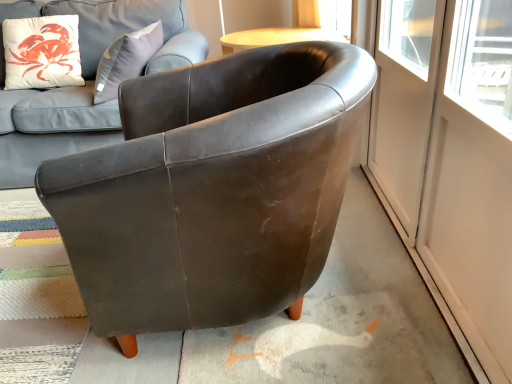
What is the approximate width of matte white cushion at upper left?

matte white cushion at upper left is 26.46 centimeters in width.

Where is `brown leather armchair at center`? This screenshot has height=384, width=512. brown leather armchair at center is located at coordinates (213, 189).

The image size is (512, 384). What are the coordinates of `transparent glass screen door at right, which is the 2th screen door from right to left` in the screenshot? It's located at 445,175.

What do you see at coordinates (86, 82) in the screenshot? This screenshot has width=512, height=384. I see `matte brown leather couch at upper left` at bounding box center [86, 82].

Identify the location of matte white cushion at upper left. (42, 52).

Is point (200, 52) closer to viewer compared to point (477, 182)?

No.

Is matte brown leather couch at upper left inside or outside of transparent glass screen door at right, marked as the first screen door in a left-to-right arrangement?

matte brown leather couch at upper left is spatially situated outside transparent glass screen door at right, marked as the first screen door in a left-to-right arrangement.

Which object is thinner, matte brown leather couch at upper left or transparent glass screen door at right, marked as the first screen door in a left-to-right arrangement?

transparent glass screen door at right, marked as the first screen door in a left-to-right arrangement.

Considering the relative sizes of matte brown leather couch at upper left and transparent glass screen door at right, which is the 2th screen door from right to left, in the image provided, is matte brown leather couch at upper left taller than transparent glass screen door at right, which is the 2th screen door from right to left,?

Yes, matte brown leather couch at upper left is taller than transparent glass screen door at right, which is the 2th screen door from right to left.

Locate an element on the screen. chair beneath the matte brown leather couch at upper left (from a real-world perspective) is located at coordinates (213, 189).

Is there a large distance between matte brown leather couch at upper left and brown leather armchair at center?

matte brown leather couch at upper left is far away from brown leather armchair at center.

Based on the photo, could brown leather armchair at center be considered to be inside matte brown leather couch at upper left?

No, brown leather armchair at center is not a part of matte brown leather couch at upper left.

From a real-world perspective, between matte brown leather couch at upper left and brown leather armchair at center, who is vertically lower?

From a 3D spatial view, brown leather armchair at center is below.

Which of these two, transparent glass screen door at right, marked as the first screen door in a left-to-right arrangement, or brown leather armchair at center, is wider?

→ With larger width is brown leather armchair at center.

From the image's perspective, is transparent glass screen door at right, marked as the first screen door in a left-to-right arrangement, under brown leather armchair at center?

No, from the image's perspective, transparent glass screen door at right, marked as the first screen door in a left-to-right arrangement, is not beneath brown leather armchair at center.

Is transparent glass screen door at right, which is the 2th screen door from right to left, shorter than brown leather armchair at center?

Incorrect, the height of transparent glass screen door at right, which is the 2th screen door from right to left, does not fall short of that of brown leather armchair at center.

Would you consider transparent glass screen door at right, marked as the first screen door in a left-to-right arrangement, to be distant from brown leather armchair at center?

No.

From a real-world perspective, is brown leather armchair at center physically below matte brown leather couch at upper left?

Yes, from a real-world perspective, brown leather armchair at center is below matte brown leather couch at upper left.

I want to click on chair located in front of the matte brown leather couch at upper left, so click(x=213, y=189).

From the image's perspective, is brown leather armchair at center above or below matte brown leather couch at upper left?

From the image's perspective, brown leather armchair at center appears below matte brown leather couch at upper left.

Can you see brown leather armchair at center touching matte brown leather couch at upper left?

There is a gap between brown leather armchair at center and matte brown leather couch at upper left.

Is transparent glass screen door at right, which is the second screen door from left to right, far from matte brown leather couch at upper left?

Answer: Yes.

Which is more to the left, transparent glass screen door at right, which is counted as the 1th screen door, starting from the right, or matte brown leather couch at upper left?

From the viewer's perspective, matte brown leather couch at upper left appears more on the left side.

Considering the relative sizes of transparent glass screen door at right, which is the second screen door from left to right, and matte brown leather couch at upper left in the image provided, is transparent glass screen door at right, which is the second screen door from left to right, smaller than matte brown leather couch at upper left?

Yes, transparent glass screen door at right, which is the second screen door from left to right, is smaller than matte brown leather couch at upper left.

Measure the distance between transparent glass screen door at right, which is counted as the 1th screen door, starting from the right, and matte brown leather couch at upper left.

They are 4.24 feet apart.

Considering their positions, is transparent glass screen door at right, which is the second screen door from left to right, located in front of or behind matte white cushion at upper left?

In the image, transparent glass screen door at right, which is the second screen door from left to right, appears in front of matte white cushion at upper left.

Considering the sizes of objects transparent glass screen door at right, which is the second screen door from left to right, and matte white cushion at upper left in the image provided, who is thinner, transparent glass screen door at right, which is the second screen door from left to right, or matte white cushion at upper left?

Thinner between the two is transparent glass screen door at right, which is the second screen door from left to right.

Is transparent glass screen door at right, which is counted as the 1th screen door, starting from the right, looking in the opposite direction of matte white cushion at upper left?

transparent glass screen door at right, which is counted as the 1th screen door, starting from the right, is not turned away from matte white cushion at upper left.

From a real-world perspective, which object stands above the other?

matte white cushion at upper left is physically above.

Can you confirm if transparent glass screen door at right, marked as the first screen door in a left-to-right arrangement, is wider than transparent glass screen door at right, which is the second screen door from left to right?

Indeed, transparent glass screen door at right, marked as the first screen door in a left-to-right arrangement, has a greater width compared to transparent glass screen door at right, which is the second screen door from left to right.

Between transparent glass screen door at right, marked as the first screen door in a left-to-right arrangement, and transparent glass screen door at right, which is the second screen door from left to right, which one has larger size?

transparent glass screen door at right, marked as the first screen door in a left-to-right arrangement.

Locate an element on the screen. screen door below the transparent glass screen door at right, which is counted as the 1th screen door, starting from the right (from the image's perspective) is located at coordinates (445, 175).

Considering the positions of objects transparent glass screen door at right, which is the 2th screen door from right to left, and transparent glass screen door at right, which is the second screen door from left to right, in the image provided, who is more to the left, transparent glass screen door at right, which is the 2th screen door from right to left, or transparent glass screen door at right, which is the second screen door from left to right,?

transparent glass screen door at right, which is the 2th screen door from right to left.

Where is `studio couch on the left of transparent glass screen door at right, marked as the first screen door in a left-to-right arrangement`? This screenshot has height=384, width=512. studio couch on the left of transparent glass screen door at right, marked as the first screen door in a left-to-right arrangement is located at coordinates (86, 82).

The height and width of the screenshot is (384, 512). I want to click on studio couch above the brown leather armchair at center (from a real-world perspective), so (86, 82).

Which object lies nearer to the anchor point matte brown leather couch at upper left, transparent glass screen door at right, which is the second screen door from left to right, or matte white cushion at upper left?

matte white cushion at upper left is closer to matte brown leather couch at upper left.

Looking at the image, which one is located further to transparent glass screen door at right, which is the second screen door from left to right, brown leather armchair at center or matte white cushion at upper left?

matte white cushion at upper left lies further to transparent glass screen door at right, which is the second screen door from left to right, than the other object.

Looking at the image, which one is located further to matte white cushion at upper left, matte brown leather couch at upper left or brown leather armchair at center?

brown leather armchair at center lies further to matte white cushion at upper left than the other object.

When comparing their distances from matte white cushion at upper left, does transparent glass screen door at right, which is the 2th screen door from right to left, or transparent glass screen door at right, which is the second screen door from left to right, seem closer?

Among the two, transparent glass screen door at right, which is the second screen door from left to right, is located nearer to matte white cushion at upper left.

Looking at the image, which one is located closer to transparent glass screen door at right, which is counted as the 1th screen door, starting from the right, matte white cushion at upper left or transparent glass screen door at right, marked as the first screen door in a left-to-right arrangement?

The object closer to transparent glass screen door at right, which is counted as the 1th screen door, starting from the right, is transparent glass screen door at right, marked as the first screen door in a left-to-right arrangement.

Based on their spatial positions, is transparent glass screen door at right, which is counted as the 1th screen door, starting from the right, or matte brown leather couch at upper left further from matte white cushion at upper left?

Among the two, transparent glass screen door at right, which is counted as the 1th screen door, starting from the right, is located further to matte white cushion at upper left.

Based on their spatial positions, is brown leather armchair at center or matte brown leather couch at upper left closer to transparent glass screen door at right, which is the 2th screen door from right to left?

brown leather armchair at center lies closer to transparent glass screen door at right, which is the 2th screen door from right to left, than the other object.

Which object lies nearer to the anchor point matte brown leather couch at upper left, brown leather armchair at center or matte white cushion at upper left?

The object closer to matte brown leather couch at upper left is matte white cushion at upper left.

Find the location of a particular element. The width and height of the screenshot is (512, 384). screen door situated between matte white cushion at upper left and transparent glass screen door at right, which is counted as the 1th screen door, starting from the right, from left to right is located at coordinates (445, 175).

I want to click on studio couch between brown leather armchair at center and matte white cushion at upper left along the z-axis, so click(86, 82).

I want to click on chair located between matte brown leather couch at upper left and transparent glass screen door at right, which is the second screen door from left to right, in the left-right direction, so click(x=213, y=189).

The image size is (512, 384). I want to click on screen door between matte brown leather couch at upper left and transparent glass screen door at right, which is counted as the 1th screen door, starting from the right, in the horizontal direction, so click(445, 175).